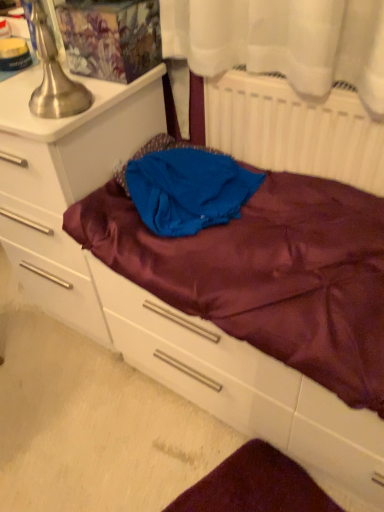
Question: Considering the relative sizes of matte white chest of drawers at left and brushed metal table lamp at upper left in the image provided, is matte white chest of drawers at left thinner than brushed metal table lamp at upper left?

Choices:
 (A) yes
 (B) no

Answer: (B)

Question: From the image's perspective, would you say matte white chest of drawers at left is positioned over brushed metal table lamp at upper left?

Choices:
 (A) no
 (B) yes

Answer: (A)

Question: Is matte white chest of drawers at left outside brushed metal table lamp at upper left?

Choices:
 (A) no
 (B) yes

Answer: (B)

Question: Considering the relative sizes of matte white chest of drawers at left and brushed metal table lamp at upper left in the image provided, is matte white chest of drawers at left wider than brushed metal table lamp at upper left?

Choices:
 (A) yes
 (B) no

Answer: (A)

Question: Does matte white chest of drawers at left have a larger size compared to brushed metal table lamp at upper left?

Choices:
 (A) no
 (B) yes

Answer: (B)

Question: From the image's perspective, is matte white chest of drawers at left located beneath brushed metal table lamp at upper left?

Choices:
 (A) yes
 (B) no

Answer: (A)

Question: Is white matte radiator at upper right turned away from brushed metal table lamp at upper left?

Choices:
 (A) no
 (B) yes

Answer: (A)

Question: Is white matte radiator at upper right completely or partially outside of brushed metal table lamp at upper left?

Choices:
 (A) yes
 (B) no

Answer: (A)

Question: Does white matte radiator at upper right have a greater width compared to brushed metal table lamp at upper left?

Choices:
 (A) yes
 (B) no

Answer: (B)

Question: Does white matte radiator at upper right appear on the right side of brushed metal table lamp at upper left?

Choices:
 (A) no
 (B) yes

Answer: (B)

Question: Would you consider white matte radiator at upper right to be distant from brushed metal table lamp at upper left?

Choices:
 (A) yes
 (B) no

Answer: (B)

Question: Is white matte radiator at upper right further to camera compared to brushed metal table lamp at upper left?

Choices:
 (A) no
 (B) yes

Answer: (B)

Question: Can you confirm if blue satin cloth at center is shorter than satin purple drawer at center?

Choices:
 (A) yes
 (B) no

Answer: (A)